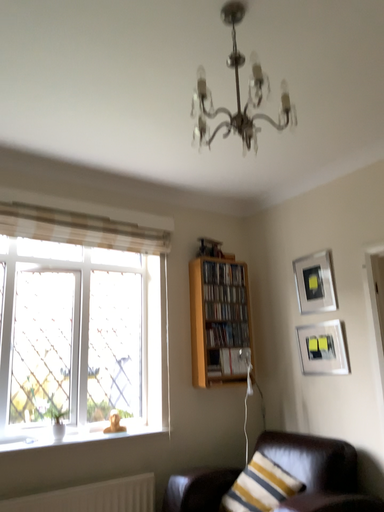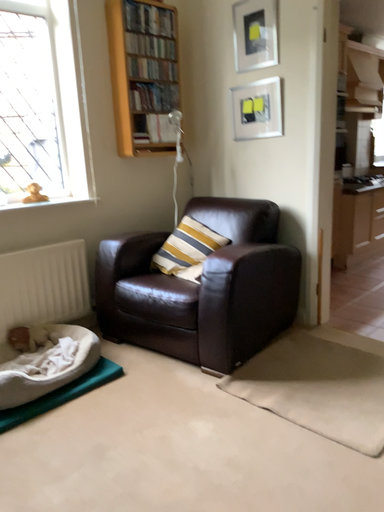
Question: Which way did the camera rotate in the video?

Choices:
 (A) rotated left
 (B) rotated right

Answer: (B)